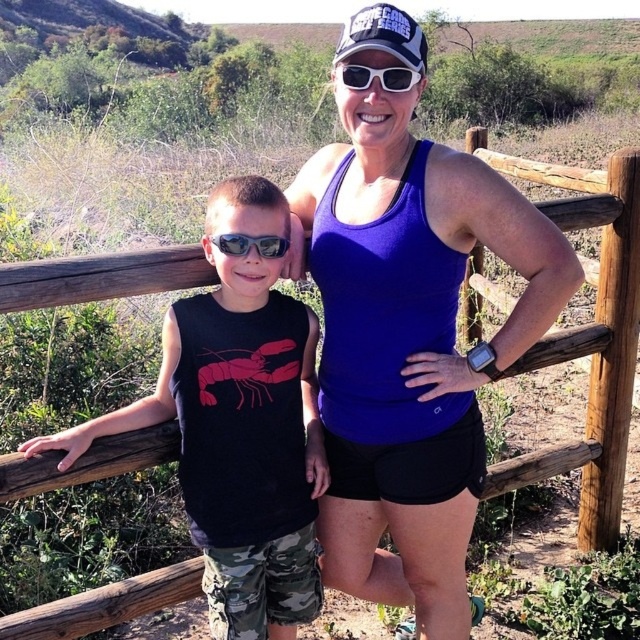
Question: Which of the following is the farthest from the observer?

Choices:
 (A) black cotton shirt at left
 (B) purple fabric tank top at center
 (C) sunglasses at center
 (D) matte black goggles at left

Answer: (D)

Question: Is black cotton shirt at left further to the viewer compared to sunglasses at center?

Choices:
 (A) no
 (B) yes

Answer: (B)

Question: Among these points, which one is farthest from the camera?

Choices:
 (A) (252, 413)
 (B) (362, 308)
 (C) (336, 68)
 (D) (268, 256)

Answer: (A)

Question: Which object is closer to the camera taking this photo?

Choices:
 (A) black cotton shirt at left
 (B) sunglasses at center
 (C) matte black goggles at left

Answer: (B)

Question: Is black cotton shirt at left closer to the viewer compared to sunglasses at center?

Choices:
 (A) no
 (B) yes

Answer: (A)

Question: Does purple fabric tank top at center have a smaller size compared to sunglasses at center?

Choices:
 (A) no
 (B) yes

Answer: (A)